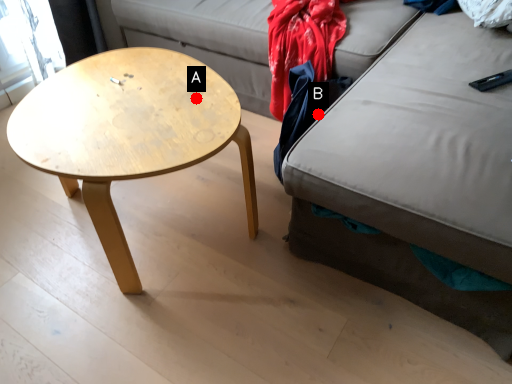
Question: Two points are circled on the image, labeled by A and B beside each circle. Which point appears farthest from the camera in this image?

Choices:
 (A) A is further
 (B) B is further

Answer: (B)